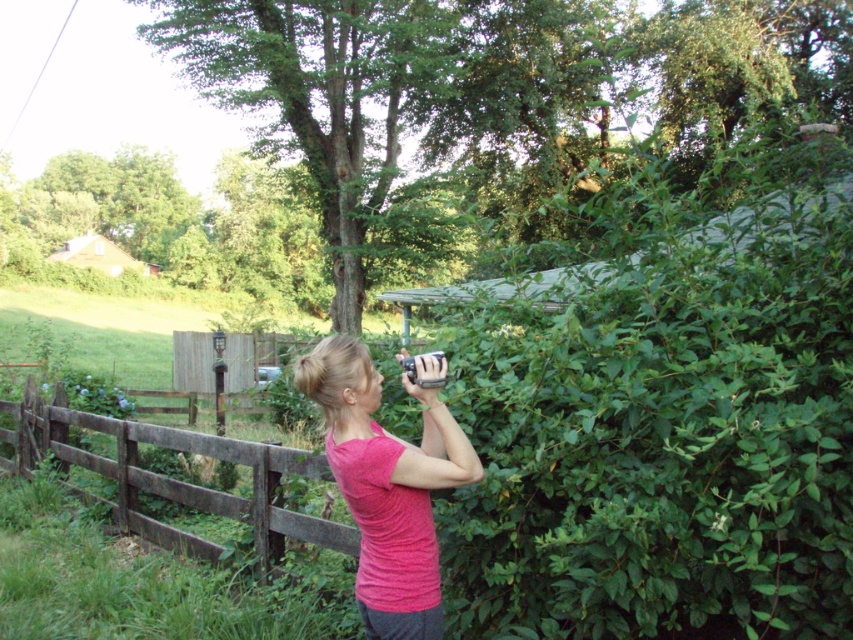
You are a photographer wanting to capture the brown wooden fence at left in your shot. You have a metallic silver camera at upper center. Which direction should you move the camera to include the fence in the frame?

The brown wooden fence at left is to the left of the metallic silver camera at upper center. To include the fence in the frame, you should move the camera to the left.

You are standing at the position of the person in the image. You want to place a 3.5 meter long ladder between the pink fabric shirt at center and the brown wooden fence at left. Is there enough space for the ladder?

The distance between the pink fabric shirt at center and the brown wooden fence at left is 4.22 meters, which is longer than the ladder length of 3.5 meters. Therefore, there is enough space to place the ladder between them.

You are a photographer trying to capture a clear shot of the brown wooden fence at left. However, your metallic silver camera at upper center is blocking the view. How can you adjust your position to ensure the fence is fully visible in your photo?

Move the metallic silver camera at upper center forward so it is no longer behind the brown wooden fence at left, allowing the fence to be fully visible in the photo.